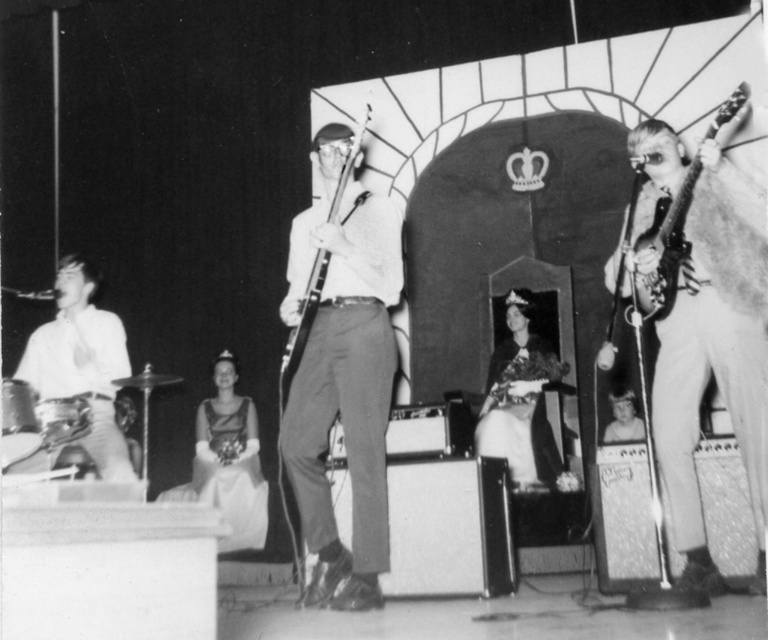
Question: Does matte gray pants at center have a greater width compared to metallic silver bass at center?

Choices:
 (A) yes
 (B) no

Answer: (A)

Question: Which point is farther to the camera?

Choices:
 (A) (740, 93)
 (B) (740, 320)
 (C) (103, 372)
 (D) (293, 352)

Answer: (C)

Question: Which of the following is the closest to the observer?

Choices:
 (A) metallic silver bass at center
 (B) shiny silver guitar at right
 (C) metallic silver electric guitar at right
 (D) smooth white shirt at left

Answer: (C)

Question: Does shiny silver guitar at right appear on the left side of matte gray pants at center?

Choices:
 (A) no
 (B) yes

Answer: (A)

Question: Which of these objects is positioned closest to the matte gray pants at center?

Choices:
 (A) metallic silver bass at center
 (B) metallic silver electric guitar at right
 (C) shiny silver guitar at right

Answer: (A)

Question: From the image, what is the correct spatial relationship of matte gray pants at center in relation to smooth white shirt at left?

Choices:
 (A) left
 (B) right

Answer: (B)